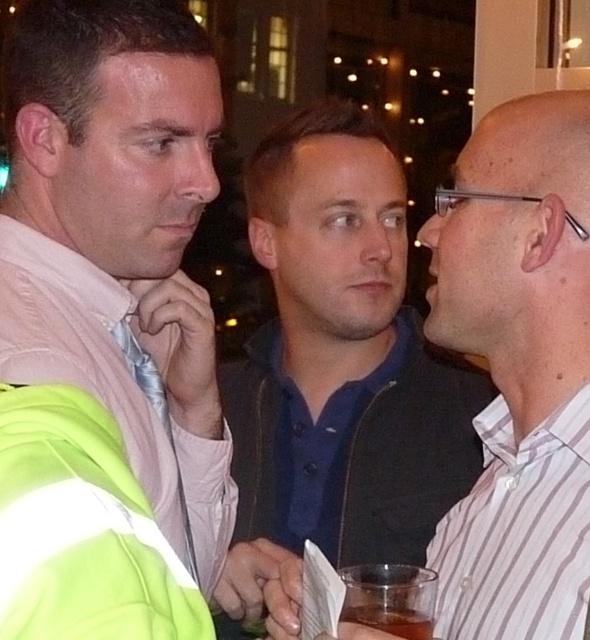
Question: Based on their relative distances, which object is nearer to the pink fabric shirt at left?

Choices:
 (A) blue shirt at center
 (B) green reflective safety vest at lower left
 (C) brown translucent glass at lower center

Answer: (B)

Question: Can you confirm if pink fabric shirt at left is smaller than brown translucent glass at lower center?

Choices:
 (A) yes
 (B) no

Answer: (B)

Question: Can you confirm if blue shirt at center is wider than brown translucent glass at lower center?

Choices:
 (A) no
 (B) yes

Answer: (B)

Question: Which point is closer to the camera?

Choices:
 (A) pink fabric shirt at left
 (B) green reflective safety vest at lower left

Answer: (B)

Question: Can you confirm if pink fabric shirt at left is smaller than green reflective safety vest at lower left?

Choices:
 (A) yes
 (B) no

Answer: (B)

Question: Estimate the real-world distances between objects in this image. Which object is closer to the blue shirt at center?

Choices:
 (A) brown translucent glass at lower center
 (B) pink fabric shirt at left
 (C) green reflective safety vest at lower left

Answer: (A)